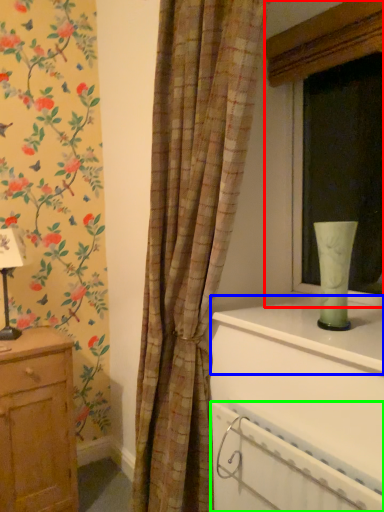
Question: Which object is the farthest from window (highlighted by a red box)? Choose among these: window sill (highlighted by a blue box) or radiator (highlighted by a green box).

Choices:
 (A) window sill
 (B) radiator

Answer: (B)